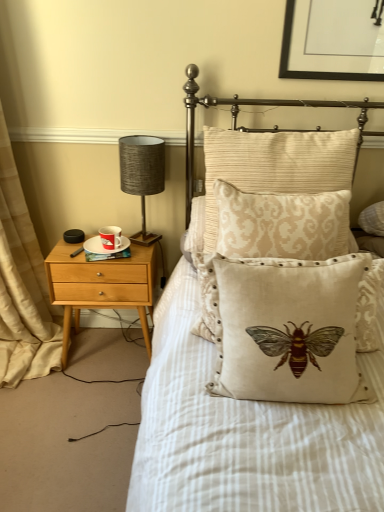
At what (x,y) coordinates should I click in order to perform the action: click on beige fabric curtain at left. Please return your answer as a coordinate pair (x, y). The height and width of the screenshot is (512, 384). Looking at the image, I should click on (23, 285).

Describe the element at coordinates (275, 165) in the screenshot. I see `beige damask pillow at center, the 1th pillow when ordered from back to front` at that location.

Locate an element on the screen. beige damask pillow at center, which ranks as the 3th pillow in front-to-back order is located at coordinates (275, 165).

The width and height of the screenshot is (384, 512). What do you see at coordinates (282, 224) in the screenshot? I see `beige damask pillow at center, which is the 2th pillow in back-to-front order` at bounding box center [282, 224].

Locate an element on the screen. Image resolution: width=384 pixels, height=512 pixels. white ceramic saucer at left is located at coordinates (103, 247).

Is white ceramic saucer at left wider than textured gray lampshade at left?

No, white ceramic saucer at left is not wider than textured gray lampshade at left.

From the image's perspective, is white ceramic saucer at left under textured gray lampshade at left?

Yes, from the image's perspective, white ceramic saucer at left is below textured gray lampshade at left.

From a real-world perspective, who is located lower, white ceramic saucer at left or textured gray lampshade at left?

white ceramic saucer at left is physically lower.

Considering the positions of objects white ceramic saucer at left and textured gray lampshade at left in the image provided, who is more to the left, white ceramic saucer at left or textured gray lampshade at left?

From the viewer's perspective, white ceramic saucer at left appears more on the left side.

Considering the sizes of objects red glossy mug at left and textured gray lampshade at left in the image provided, who is bigger, red glossy mug at left or textured gray lampshade at left?

With larger size is textured gray lampshade at left.

Locate an element on the screen. This screenshot has width=384, height=512. coffee cup behind the textured gray lampshade at left is located at coordinates click(x=110, y=237).

Does red glossy mug at left have a greater height compared to textured gray lampshade at left?

No, red glossy mug at left is not taller than textured gray lampshade at left.

Is red glossy mug at left wider than textured gray lampshade at left?

No, red glossy mug at left is not wider than textured gray lampshade at left.

Would you say beige damask pillow at center, which ranks as the 3th pillow in front-to-back order, is a long distance from beige embroidered cushion with bee design at center, the 3th pillow in the back-to-front sequence?

beige damask pillow at center, which ranks as the 3th pillow in front-to-back order, is actually quite close to beige embroidered cushion with bee design at center, the 3th pillow in the back-to-front sequence.

From a real-world perspective, is beige damask pillow at center, which ranks as the 3th pillow in front-to-back order, located higher than beige embroidered cushion with bee design at center, the 3th pillow in the back-to-front sequence?

Yes, from a real-world perspective, beige damask pillow at center, which ranks as the 3th pillow in front-to-back order, is on top of beige embroidered cushion with bee design at center, the 3th pillow in the back-to-front sequence.

Considering the sizes of objects beige damask pillow at center, the 1th pillow when ordered from back to front, and beige embroidered cushion with bee design at center, the 3th pillow in the back-to-front sequence, in the image provided, who is thinner, beige damask pillow at center, the 1th pillow when ordered from back to front, or beige embroidered cushion with bee design at center, the 3th pillow in the back-to-front sequence,?

Thinner between the two is beige embroidered cushion with bee design at center, the 3th pillow in the back-to-front sequence.

Considering the relative positions of beige damask pillow at center, the 1th pillow when ordered from back to front, and beige embroidered cushion with bee design at center, which is counted as the 1th pillow, starting from the front, in the image provided, is beige damask pillow at center, the 1th pillow when ordered from back to front, to the left of beige embroidered cushion with bee design at center, which is counted as the 1th pillow, starting from the front, from the viewer's perspective?

No.

Which object is further away from the camera, beige fabric curtain at left or beige embroidered cushion with bee design at center, which is counted as the 1th pillow, starting from the front?

Positioned behind is beige fabric curtain at left.

Is beige fabric curtain at left looking in the opposite direction of beige embroidered cushion with bee design at center, the 3th pillow in the back-to-front sequence?

No, beige fabric curtain at left is not facing away from beige embroidered cushion with bee design at center, the 3th pillow in the back-to-front sequence.

Considering the positions of objects beige fabric curtain at left and beige embroidered cushion with bee design at center, which is counted as the 1th pillow, starting from the front, in the image provided, who is more to the right, beige fabric curtain at left or beige embroidered cushion with bee design at center, which is counted as the 1th pillow, starting from the front,?

beige embroidered cushion with bee design at center, which is counted as the 1th pillow, starting from the front.

Does beige fabric curtain at left turn towards red glossy mug at left?

Yes, beige fabric curtain at left is oriented towards red glossy mug at left.

Is beige fabric curtain at left positioned behind red glossy mug at left?

No, beige fabric curtain at left is closer to the camera.

Is beige fabric curtain at left touching red glossy mug at left?

No, beige fabric curtain at left is not with red glossy mug at left.

From a real-world perspective, is beige fabric curtain at left physically below red glossy mug at left?

No.

Can you see white ceramic saucer at left touching light wood/finely crafted nightstand at left?

There is a gap between white ceramic saucer at left and light wood/finely crafted nightstand at left.

Which is farther from the camera, (124, 249) or (70, 245)?

The point (70, 245) is behind.

Is white ceramic saucer at left oriented towards light wood/finely crafted nightstand at left?

No.

Which object is positioned more to the left, white ceramic saucer at left or light wood/finely crafted nightstand at left?

light wood/finely crafted nightstand at left.

Could you tell me if textured gray lampshade at left is turned towards red glossy mug at left?

No.

Visually, is textured gray lampshade at left positioned to the left or to the right of red glossy mug at left?

textured gray lampshade at left is positioned on red glossy mug at left's right side.

Consider the image. From a real-world perspective, does textured gray lampshade at left stand above red glossy mug at left?

Yes.

Is textured gray lampshade at left in front of or behind red glossy mug at left in the image?

Clearly, textured gray lampshade at left is in front of red glossy mug at left.

The image size is (384, 512). In order to click on table lamp in front of the white ceramic saucer at left in this screenshot , I will do `click(142, 175)`.

Find the location of a particular element. table lamp that is above the red glossy mug at left (from the image's perspective) is located at coordinates 142,175.

Looking at this image, when comparing their distances from beige embroidered cushion with bee design at center, the 3th pillow in the back-to-front sequence, does beige damask pillow at center, the 1th pillow when ordered from back to front, or textured gray lampshade at left seem closer?

beige damask pillow at center, the 1th pillow when ordered from back to front, lies closer to beige embroidered cushion with bee design at center, the 3th pillow in the back-to-front sequence, than the other object.

From the image, which object appears to be farther from beige fabric curtain at left, beige damask pillow at center, which is the 2th pillow in back-to-front order, or beige embroidered cushion with bee design at center, which is counted as the 1th pillow, starting from the front?

The object further to beige fabric curtain at left is beige embroidered cushion with bee design at center, which is counted as the 1th pillow, starting from the front.

Considering their positions, is white ceramic saucer at left positioned further to beige embroidered cushion with bee design at center, the 3th pillow in the back-to-front sequence, than textured gray lampshade at left?

white ceramic saucer at left is further to beige embroidered cushion with bee design at center, the 3th pillow in the back-to-front sequence.

When comparing their distances from textured gray lampshade at left, does beige embroidered cushion with bee design at center, which is counted as the 1th pillow, starting from the front, or beige damask pillow at center, which is the 2th pillow in back-to-front order, seem closer?

Among the two, beige damask pillow at center, which is the 2th pillow in back-to-front order, is located nearer to textured gray lampshade at left.

Which object lies further to the anchor point light wood/finely crafted nightstand at left, beige fabric curtain at left or beige damask pillow at center, which ranks as the 3th pillow in front-to-back order?

Based on the image, beige damask pillow at center, which ranks as the 3th pillow in front-to-back order, appears to be further to light wood/finely crafted nightstand at left.

Looking at the image, which one is located closer to white ceramic saucer at left, textured gray lampshade at left or light wood/finely crafted nightstand at left?

light wood/finely crafted nightstand at left.

Based on their spatial positions, is light wood/finely crafted nightstand at left or white ceramic saucer at left closer to beige fabric curtain at left?

Based on the image, light wood/finely crafted nightstand at left appears to be nearer to beige fabric curtain at left.

Considering their positions, is white ceramic saucer at left positioned closer to textured gray lampshade at left than red glossy mug at left?

Based on the image, red glossy mug at left appears to be nearer to textured gray lampshade at left.

Locate an element on the screen. This screenshot has width=384, height=512. pillow between beige fabric curtain at left and beige damask pillow at center, the second pillow positioned from the front, from left to right is located at coordinates (289, 330).

The height and width of the screenshot is (512, 384). I want to click on nightstand situated between beige fabric curtain at left and textured gray lampshade at left from left to right, so click(101, 286).

Find the location of a particular element. table lamp between beige embroidered cushion with bee design at center, which is counted as the 1th pillow, starting from the front, and red glossy mug at left, along the z-axis is located at coordinates (142, 175).

Where is `saucer situated between light wood/finely crafted nightstand at left and beige damask pillow at center, which is the 2th pillow in back-to-front order, from left to right`? This screenshot has height=512, width=384. saucer situated between light wood/finely crafted nightstand at left and beige damask pillow at center, which is the 2th pillow in back-to-front order, from left to right is located at coordinates (103, 247).